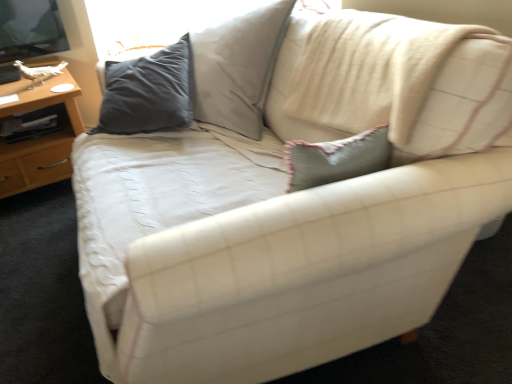
What do you see at coordinates (38, 137) in the screenshot?
I see `wooden table at left` at bounding box center [38, 137].

What is the approximate height of wooden table at left?

19.07 inches.

This screenshot has height=384, width=512. I want to click on wooden table at left, so click(38, 137).

Measure the distance between point (24, 143) and camera.

The distance of point (24, 143) from camera is 1.90 meters.

This screenshot has width=512, height=384. What do you see at coordinates (446, 99) in the screenshot?
I see `light blue textured pillow at upper right` at bounding box center [446, 99].

Identify the location of light blue textured pillow at upper right. (446, 99).

Consider the image. In order to face light blue textured pillow at upper right, should I rotate leftwards or rightwards?

You should rotate right by 18.325 degrees.

Locate an element on the screen. The width and height of the screenshot is (512, 384). wooden table at left is located at coordinates (38, 137).

Considering the relative positions of wooden table at left and light blue textured pillow at upper right in the image provided, is wooden table at left to the left of light blue textured pillow at upper right from the viewer's perspective?

Yes.

Is wooden table at left in front of light blue textured pillow at upper right?

That is False.

Considering the points (73, 135) and (433, 85), which point is behind, point (73, 135) or point (433, 85)?

The point (73, 135) is farther.

From the image's perspective, which is above, wooden table at left or light blue textured pillow at upper right?

From the image's view, light blue textured pillow at upper right is above.

From a real-world perspective, is wooden table at left beneath light blue textured pillow at upper right?

Yes, from a real-world perspective, wooden table at left is under light blue textured pillow at upper right.

Is wooden table at left wider than light blue textured pillow at upper right?

Indeed, wooden table at left has a greater width compared to light blue textured pillow at upper right.

Is wooden table at left shorter than light blue textured pillow at upper right?

Indeed, wooden table at left has a lesser height compared to light blue textured pillow at upper right.

Which of these two, wooden table at left or light blue textured pillow at upper right, is smaller?

wooden table at left is smaller.

Is wooden table at left not within light blue textured pillow at upper right?

wooden table at left is positioned outside light blue textured pillow at upper right.

Would you say wooden table at left is a long distance from light blue textured pillow at upper right?

That's right, there is a large distance between wooden table at left and light blue textured pillow at upper right.

Could you tell me if wooden table at left is facing light blue textured pillow at upper right?

No, wooden table at left is not turned towards light blue textured pillow at upper right.

How different are the orientations of wooden table at left and light blue textured pillow at upper right in degrees?

91.7 degrees separate the facing orientations of wooden table at left and light blue textured pillow at upper right.

I want to click on table behind the light blue textured pillow at upper right, so click(38, 137).

Based on their positions, is light blue textured pillow at upper right located to the left or right of wooden table at left?

light blue textured pillow at upper right is to the right of wooden table at left.

Is the depth of light blue textured pillow at upper right less than that of wooden table at left?

Yes, it is in front of wooden table at left.

Considering the positions of points (498, 49) and (36, 186), is point (498, 49) farther from camera compared to point (36, 186)?

No, (498, 49) is closer to viewer.

From the image's perspective, between light blue textured pillow at upper right and wooden table at left, who is located below?

wooden table at left is shown below in the image.

From a real-world perspective, between light blue textured pillow at upper right and wooden table at left, who is vertically higher?

From a 3D spatial view, light blue textured pillow at upper right is above.

Which of these two, light blue textured pillow at upper right or wooden table at left, is wider?

With larger width is wooden table at left.

In terms of height, does light blue textured pillow at upper right look taller or shorter compared to wooden table at left?

In the image, light blue textured pillow at upper right appears to be taller than wooden table at left.

In the scene shown: Between light blue textured pillow at upper right and wooden table at left, which one has smaller size?

wooden table at left is smaller.

Is wooden table at left completely or partially inside light blue textured pillow at upper right?

Actually, wooden table at left is outside light blue textured pillow at upper right.

Is light blue textured pillow at upper right not close to wooden table at left?

That's right, there is a large distance between light blue textured pillow at upper right and wooden table at left.

Is light blue textured pillow at upper right positioned with its back to wooden table at left?

No, light blue textured pillow at upper right is not facing away from wooden table at left.

How much distance is there between light blue textured pillow at upper right and wooden table at left?

light blue textured pillow at upper right is 1.16 meters from wooden table at left.

This screenshot has width=512, height=384. What are the coordinates of `table behind the light blue textured pillow at upper right` in the screenshot? It's located at (38, 137).

The image size is (512, 384). What are the coordinates of `table below the light blue textured pillow at upper right (from the image's perspective)` in the screenshot? It's located at (38, 137).

Image resolution: width=512 pixels, height=384 pixels. What are the coordinates of `pillow on the right of the wooden table at left` in the screenshot? It's located at (446, 99).